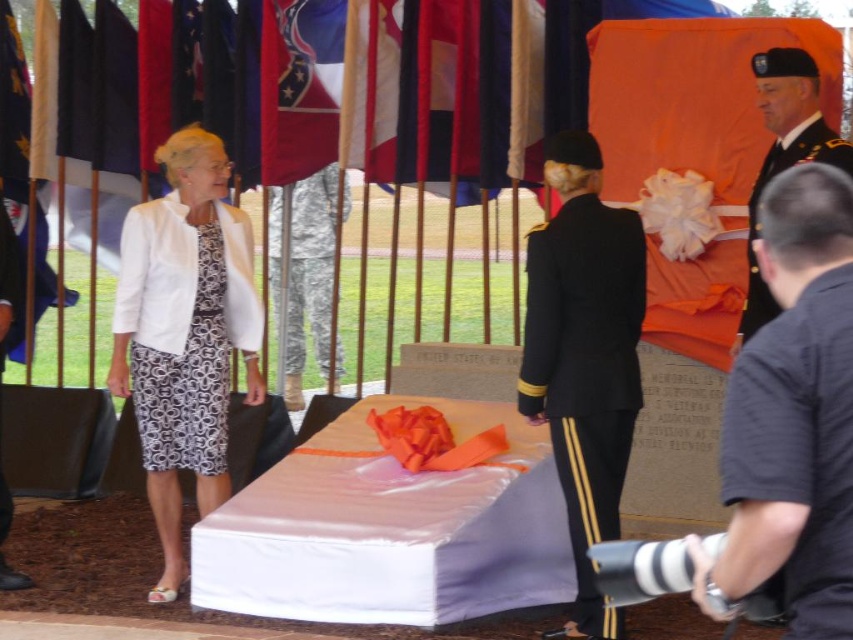
Question: Which of the following is the farthest from the observer?

Choices:
 (A) (306, 308)
 (B) (732, 77)
 (C) (822, 141)
 (D) (556, 454)

Answer: (A)

Question: Can you confirm if white textured dress at center is positioned to the left of dark blue cotton t-shirt at lower right?

Choices:
 (A) no
 (B) yes

Answer: (B)

Question: Is orange fabric flag at upper center below dark blue cotton t-shirt at lower right?

Choices:
 (A) no
 (B) yes

Answer: (A)

Question: Estimate the real-world distances between objects in this image. Which object is closer to the dark blue cotton t-shirt at lower right?

Choices:
 (A) orange fabric flag at upper center
 (B) black fabric uniform at upper right
 (C) white textured dress at center

Answer: (B)

Question: Based on their relative distances, which object is farther from the black fabric uniform at upper right?

Choices:
 (A) white textured dress at center
 (B) camouflage fabric uniform at center
 (C) black matte uniform at center
 (D) orange fabric flag at upper center

Answer: (B)

Question: Is white textured dress at center to the right of dark blue cotton t-shirt at lower right from the viewer's perspective?

Choices:
 (A) no
 (B) yes

Answer: (A)